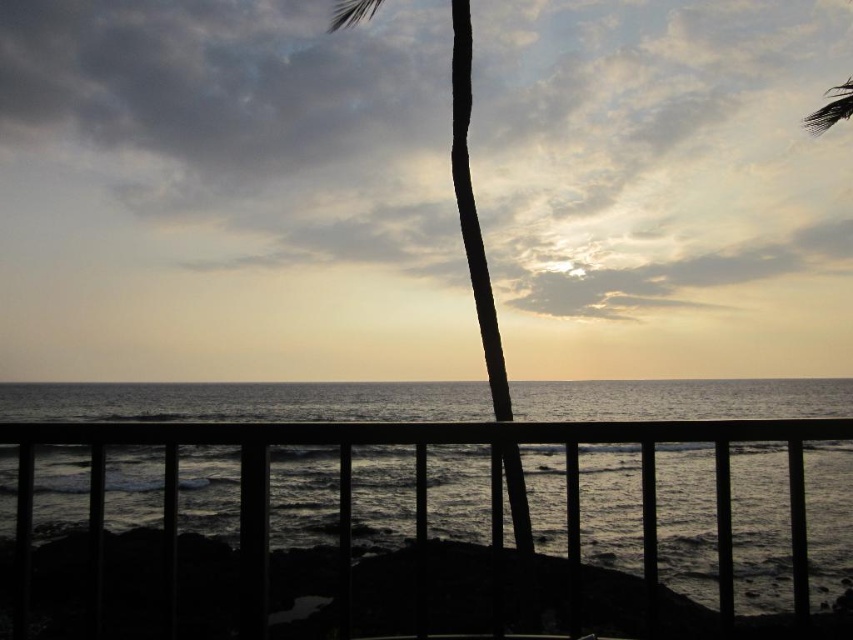
Which of these two, black wooden railing at center or silhouette wood palm tree at center, stands taller?

silhouette wood palm tree at center

Who is more forward, (573, 545) or (459, 90)?

Point (573, 545) is more forward.

Describe the element at coordinates (415, 497) in the screenshot. The width and height of the screenshot is (853, 640). I see `black wooden railing at center` at that location.

Where is `black wooden railing at center`? black wooden railing at center is located at coordinates (415, 497).